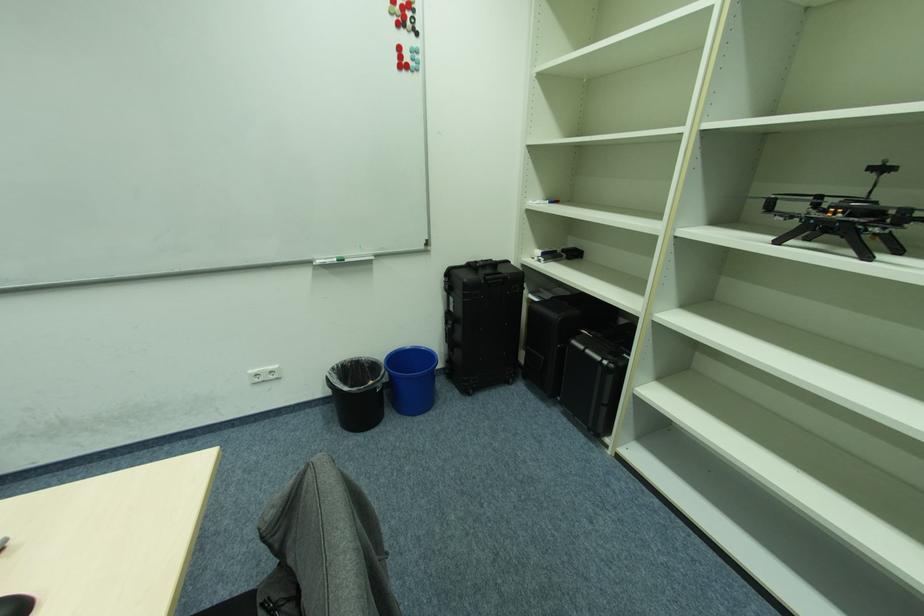
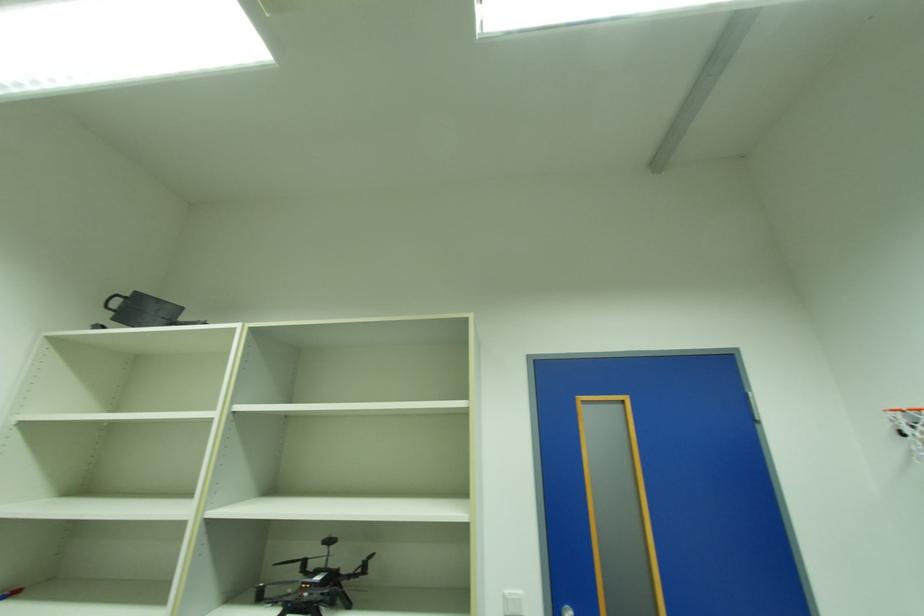
First-person continuous shooting, in which direction is the camera rotating?

The camera rotated toward right-up.